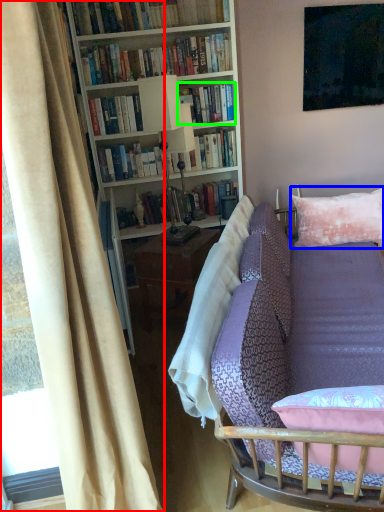
Question: Estimate the real-world distances between objects in this image. Which object is farther from curtain (highlighted by a red box), pillow (highlighted by a blue box) or book (highlighted by a green box)?

Choices:
 (A) pillow
 (B) book

Answer: (B)